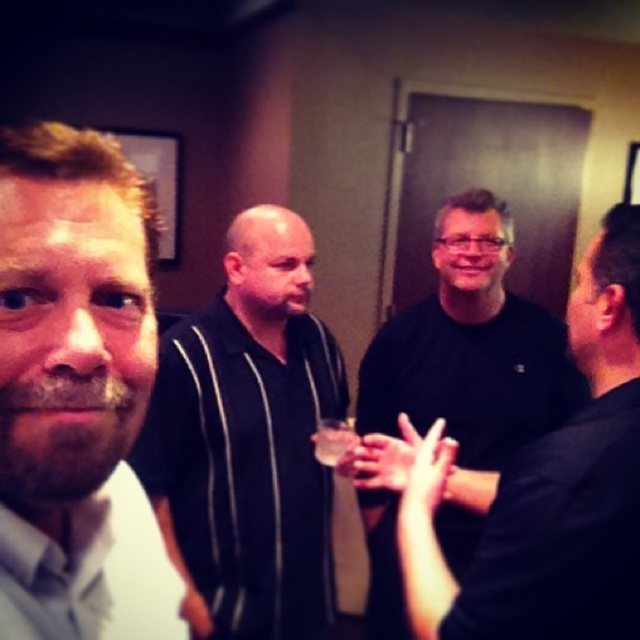
At what (x,y) coordinates should I click in order to perform the action: click on black matte shirt at center. Please return your answer as a coordinate pair (x, y). This screenshot has height=640, width=640. Looking at the image, I should click on (550, 488).

Is black matte shirt at center thinner than translucent glass beverage at center?

In fact, black matte shirt at center might be wider than translucent glass beverage at center.

Describe the element at coordinates (550, 488) in the screenshot. The height and width of the screenshot is (640, 640). I see `black matte shirt at center` at that location.

Locate an element on the screen. This screenshot has width=640, height=640. black matte shirt at center is located at coordinates (550, 488).

Is light brown hair at left bigger than black matte shirt at center?

Incorrect, light brown hair at left is not larger than black matte shirt at center.

Does light brown hair at left have a smaller size compared to black matte shirt at center?

Correct, light brown hair at left occupies less space than black matte shirt at center.

Does point (28, 621) lie in front of point (460, 589)?

Yes, point (28, 621) is closer to viewer.

Where is `light brown hair at left`? light brown hair at left is located at coordinates (76, 392).

Is black striped shirt at center wider than translucent glass beverage at center?

Indeed, black striped shirt at center has a greater width compared to translucent glass beverage at center.

Who is more forward, [301,424] or [337,436]?

Point [337,436]

Does point (188, 582) come farther from viewer compared to point (344, 444)?

Yes.

Locate an element on the screen. This screenshot has width=640, height=640. black striped shirt at center is located at coordinates (253, 448).